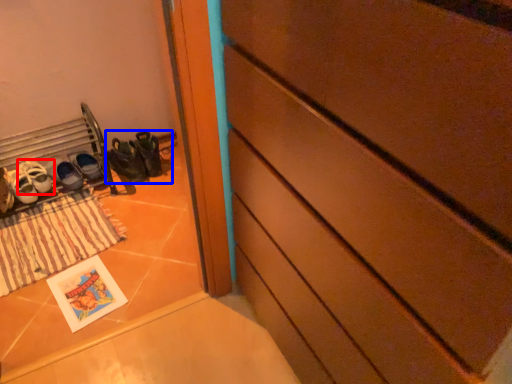
Question: Which of the following is the farthest to the observer, footwear (highlighted by a red box) or footwear (highlighted by a blue box)?

Choices:
 (A) footwear
 (B) footwear

Answer: (B)